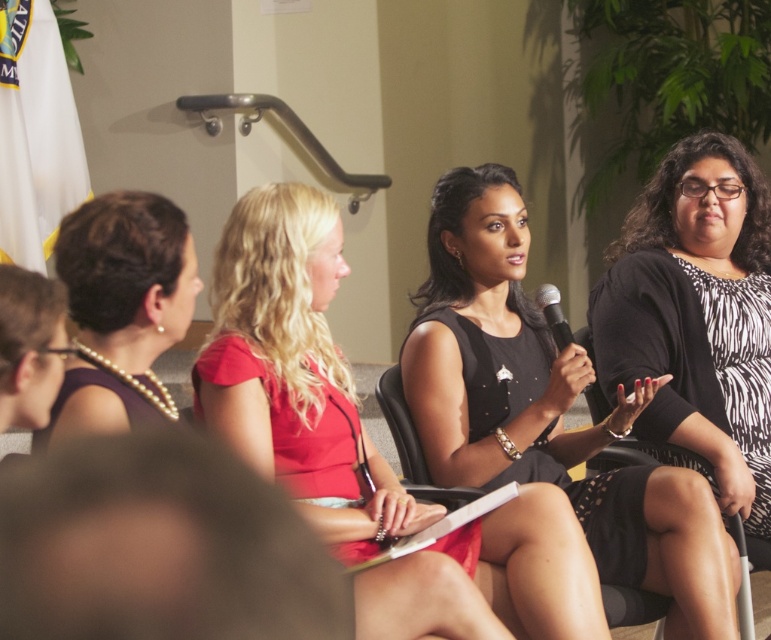
Question: Which point appears closest to the camera in this image?

Choices:
 (A) (536, 360)
 (B) (561, 316)

Answer: (B)

Question: Can you confirm if black dress at center is thinner than black metallic microphone at center?

Choices:
 (A) no
 (B) yes

Answer: (A)

Question: Which object is farther from the camera taking this photo?

Choices:
 (A) matte red dress at center
 (B) purple satin dress at left
 (C) black dress at center

Answer: (C)

Question: Is black dress at center below black zebra-patterned dress at right?

Choices:
 (A) no
 (B) yes

Answer: (B)

Question: Where is black dress at center located in relation to purple satin dress at left in the image?

Choices:
 (A) right
 (B) left

Answer: (A)

Question: Which point is closer to the camera?

Choices:
 (A) matte red dress at center
 (B) purple satin dress at left

Answer: (B)